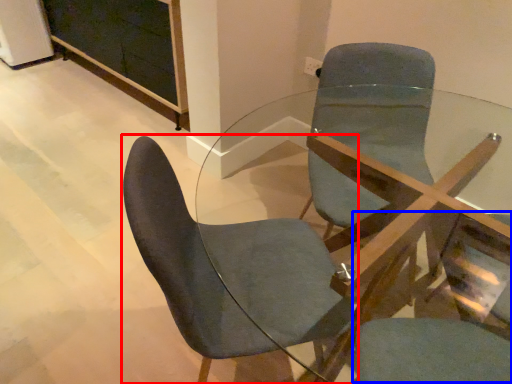
Question: Which point is closer to the camera, chair (highlighted by a red box) or swivel chair (highlighted by a blue box)?

Choices:
 (A) chair
 (B) swivel chair

Answer: (B)